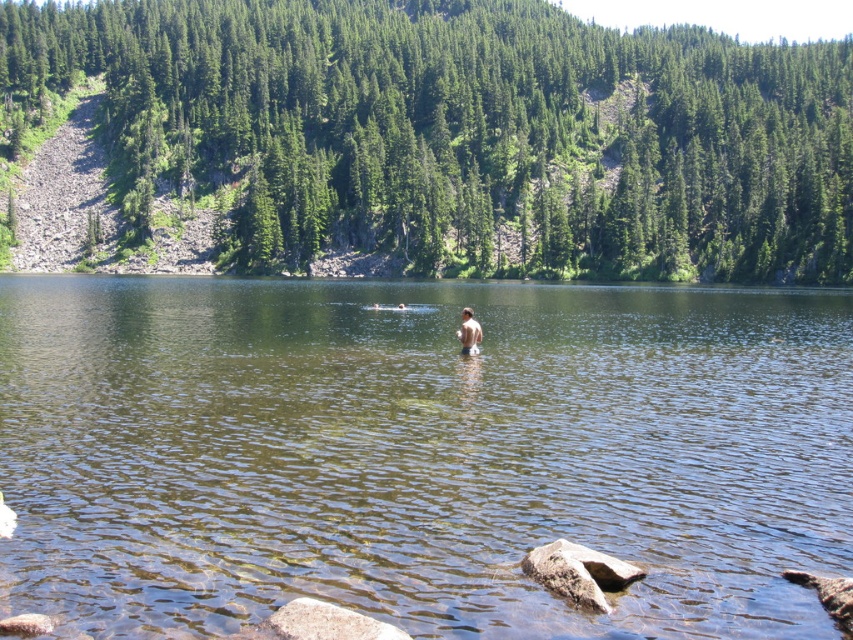
Question: Which object appears closest to the camera in this image?

Choices:
 (A) clear water at center
 (B) light brown skin at center
 (C) gray rough rock at lower center
 (D) green textured pine at upper center

Answer: (C)

Question: Which point is closer to the camera taking this photo?

Choices:
 (A) (102, 134)
 (B) (334, 636)
 (C) (166, 380)

Answer: (B)

Question: Can you confirm if green textured pine at upper center is wider than light brown skin at center?

Choices:
 (A) yes
 (B) no

Answer: (A)

Question: Is gray rough rock at lower center to the right of light brown skin at center from the viewer's perspective?

Choices:
 (A) no
 (B) yes

Answer: (A)

Question: Does clear water at center have a greater width compared to green textured pine at upper center?

Choices:
 (A) yes
 (B) no

Answer: (B)

Question: Which object appears closest to the camera in this image?

Choices:
 (A) clear water at center
 (B) gray rough rock at lower center

Answer: (B)